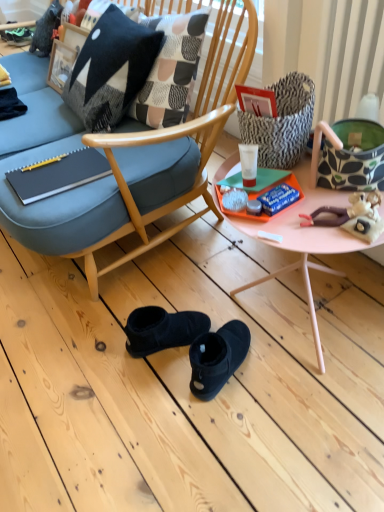
Question: Does point (297, 91) appear closer or farther from the camera than point (52, 173)?

Choices:
 (A) farther
 (B) closer

Answer: (B)

Question: Based on their sizes in the image, would you say patterned fabric handbag at upper right, acting as the 2th handbag starting from the right, is bigger or smaller than matte black notebook at left?

Choices:
 (A) big
 (B) small

Answer: (B)

Question: Which is nearer to the patterned fabric handbag at upper right, acting as the 2th handbag starting from the right?

Choices:
 (A) green suede sneakers at upper left
 (B) plush doll at right
 (C) pink plastic tray at center
 (D) green fabric handbag at right, the second handbag viewed from the left
 (E) black woolen pillow at upper left

Answer: (D)

Question: Estimate the real-world distances between objects in this image. Which object is farther from the plush doll at right?

Choices:
 (A) green fabric handbag at right, positioned as the first handbag in right-to-left order
 (B) matte black notebook at left
 (C) black woolen pillow at upper left
 (D) patterned fabric handbag at upper right, which is counted as the first handbag, starting from the left
 (E) pink plastic tray at center

Answer: (C)